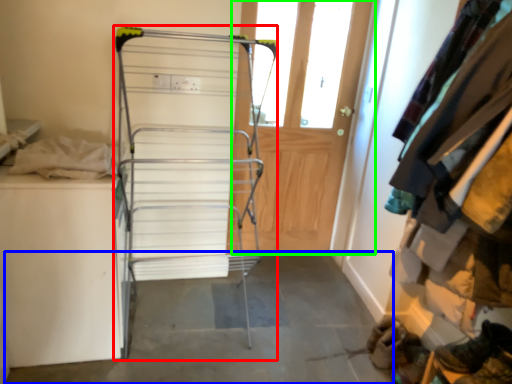
Question: Which is nearer to the furniture (highlighted by a red box)? concrete (highlighted by a blue box) or door (highlighted by a green box).

Choices:
 (A) concrete
 (B) door

Answer: (A)